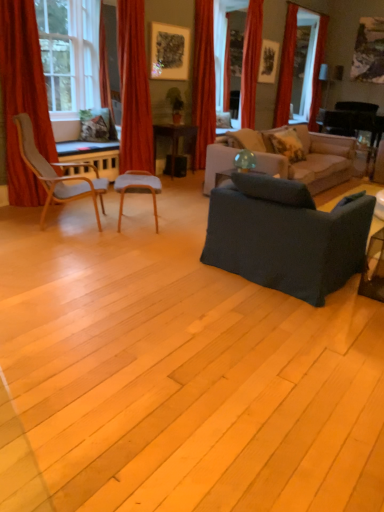
Identify the location of vacant space to the right of matte gray chair at center, which is the first chair from right to left. (181, 227).